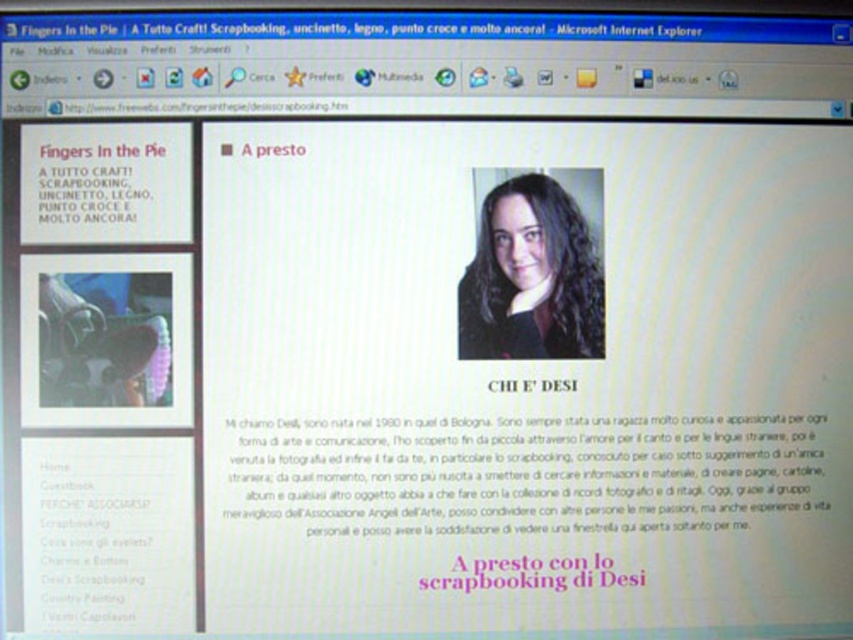
Question: Is dark brown hair at center to the right of pink paper at center from the viewer's perspective?

Choices:
 (A) no
 (B) yes

Answer: (A)

Question: Which point appears farthest from the camera in this image?

Choices:
 (A) (518, 282)
 (B) (639, 573)
 (C) (561, 388)

Answer: (A)

Question: Which object is closer to the camera taking this photo?

Choices:
 (A) dark brown hair at center
 (B) pink paper at center

Answer: (B)

Question: Can you confirm if pink paper at center is smaller than whitetexttext at center?

Choices:
 (A) no
 (B) yes

Answer: (A)

Question: Which point is closer to the camera taking this photo?

Choices:
 (A) (498, 298)
 (B) (527, 387)
 (C) (467, 584)

Answer: (C)

Question: Where is dark brown hair at center located in relation to whitetexttext at center in the image?

Choices:
 (A) left
 (B) right

Answer: (A)